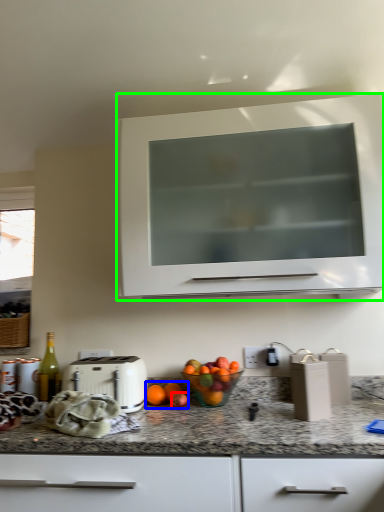
Question: Estimate the real-world distances between objects in this image. Which object is closer to apple (highlighted by a red box), citrus fruit (highlighted by a blue box) or cabinetry (highlighted by a green box)?

Choices:
 (A) citrus fruit
 (B) cabinetry

Answer: (A)